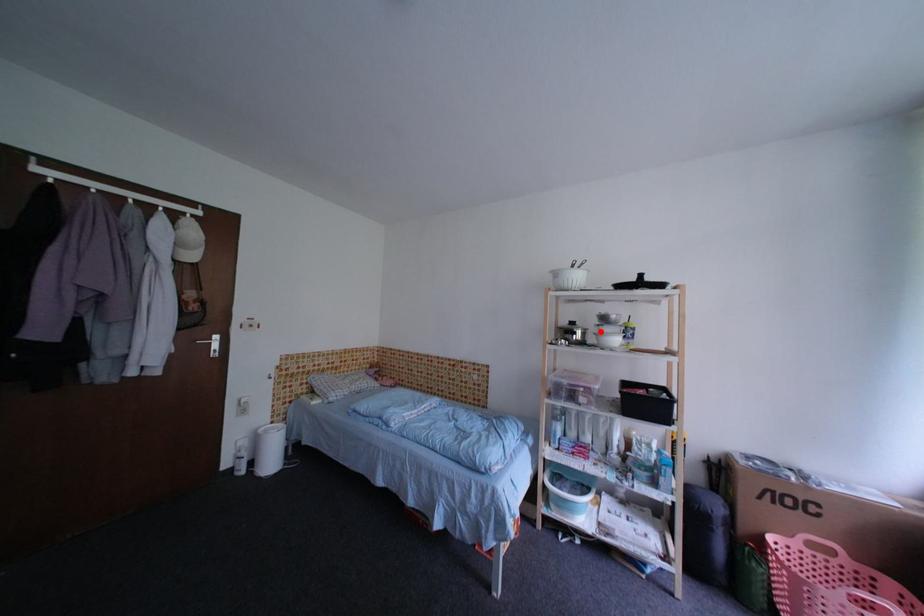
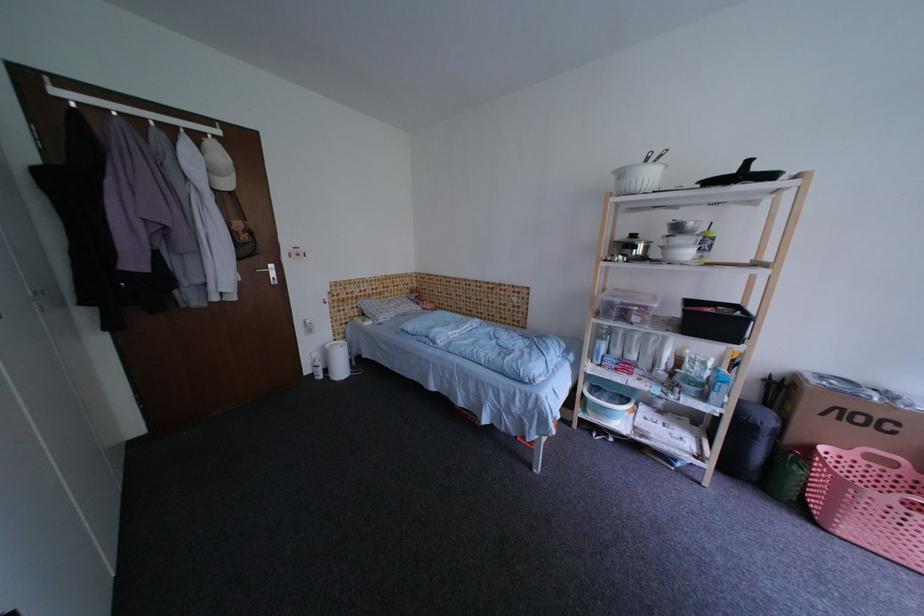
Question: I am providing you with two images of the same scene from different viewpoints. A red point is marked on the first image. At the location where the point appears in image 1, is it still visible in image 2?

Choices:
 (A) Yes
 (B) No

Answer: (A)